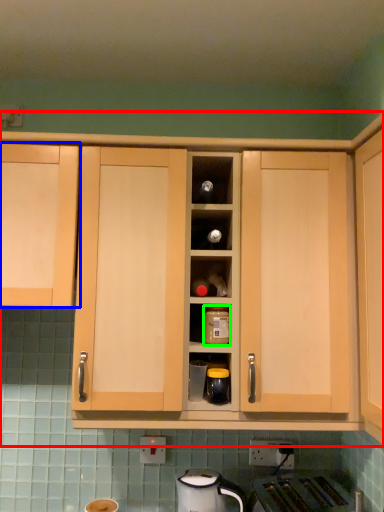
Question: Based on their relative distances, which object is farther from cabinetry (highlighted by a red box)? Choose from cabinetry (highlighted by a blue box) and kitchen appliance (highlighted by a green box).

Choices:
 (A) cabinetry
 (B) kitchen appliance

Answer: (B)